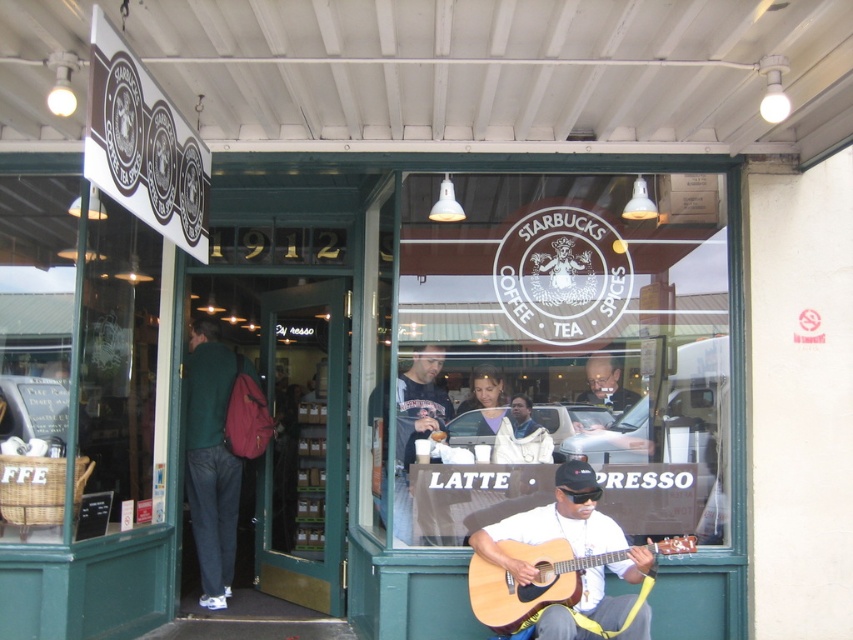
Question: Does matte black t-shirt at center lie behind matte black laptop at center?

Choices:
 (A) yes
 (B) no

Answer: (B)

Question: Which point is closer to the camera taking this photo?

Choices:
 (A) (614, 394)
 (B) (415, 356)

Answer: (B)

Question: Does natural wood acoustic guitar at lower center have a lesser width compared to matte black laptop at center?

Choices:
 (A) yes
 (B) no

Answer: (B)

Question: Is matte black laptop at center to the left of gray matte balding head at center from the viewer's perspective?

Choices:
 (A) no
 (B) yes

Answer: (A)

Question: Among these points, which one is nearest to the camera?

Choices:
 (A) (595, 364)
 (B) (679, 536)
 (C) (396, 506)
 (D) (213, 529)

Answer: (C)

Question: Which object is closer to the camera taking this photo?

Choices:
 (A) matte black laptop at center
 (B) gray matte balding head at center
 (C) green matte jacket at left
 (D) matte black t-shirt at center

Answer: (D)